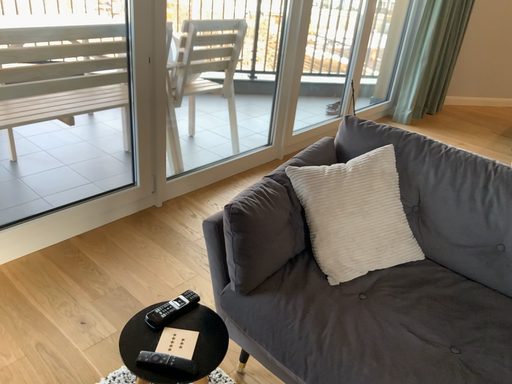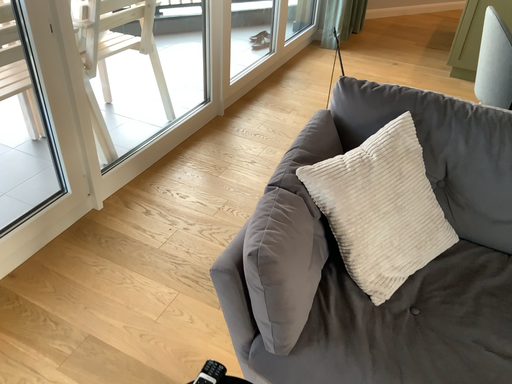
Question: How did the camera likely rotate when shooting the video?

Choices:
 (A) rotated upward
 (B) rotated downward

Answer: (B)